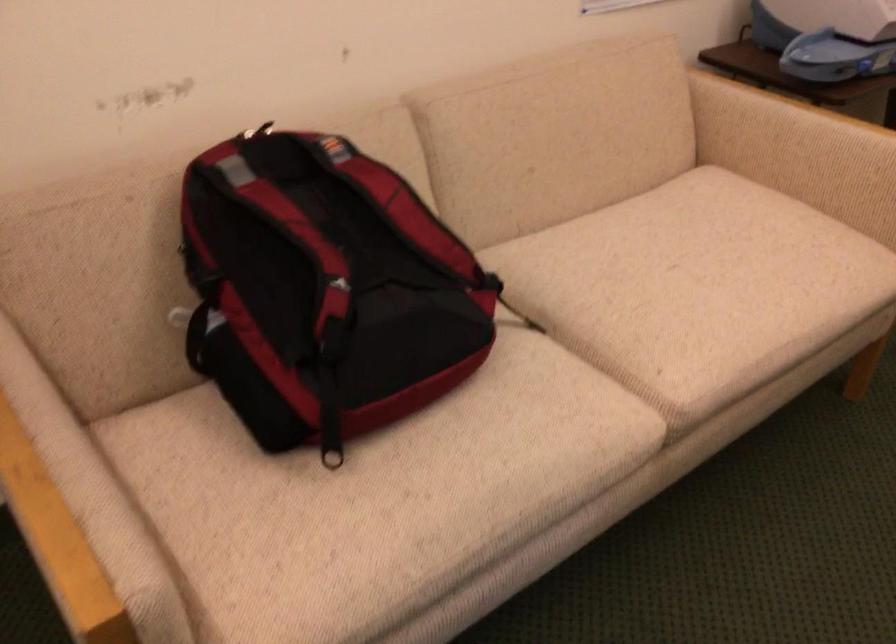
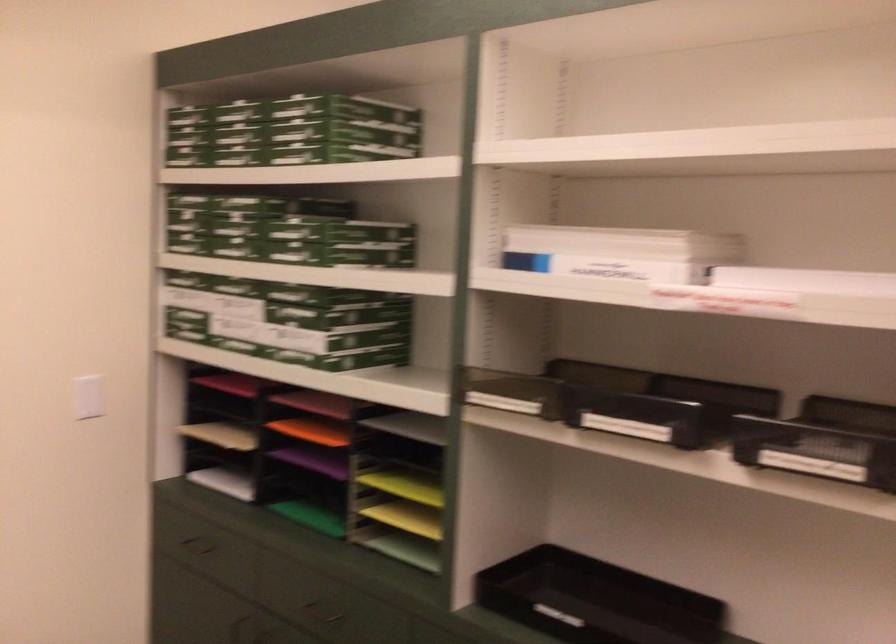
Question: Based on the continuous images, in which direction is the camera rotating? Reply with the corresponding letter.

Choices:
 (A) Left
 (B) Right
 (C) Up
 (D) Down

Answer: (B)